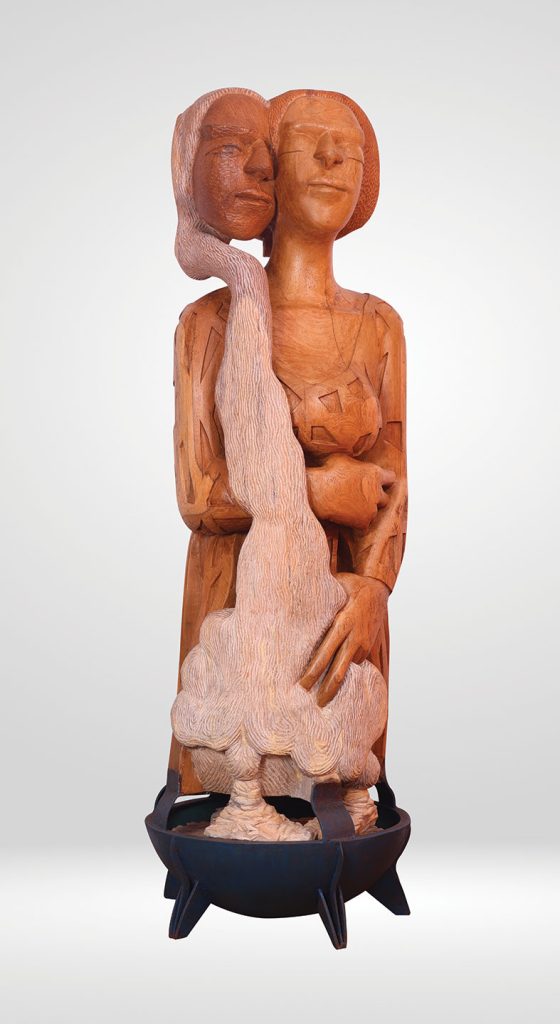
Point to visible black metal? bowl in the image. Your answer should be formatted as a list of tuples, i.e. [(x1, y1), (x2, y2), ...], where each tuple contains the x and y coordinates of a point satisfying the conditions above.

[(300, 888)]